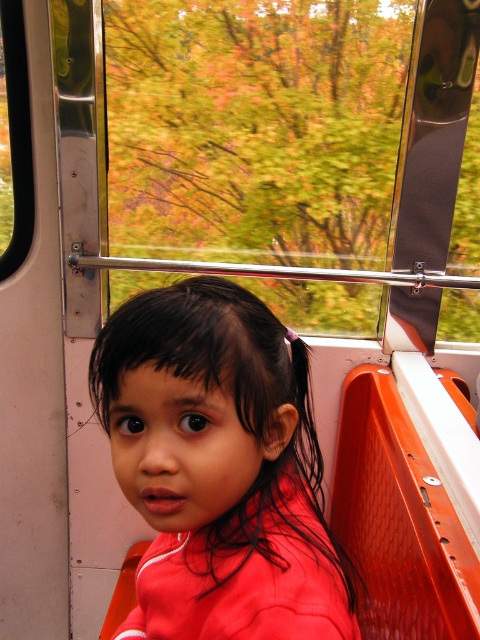
You are a passenger on a train and want to look outside through the transparent glass window at center. Where should you look relative to the point marked at (254, 129)?

The transparent glass window at center is exactly at the point marked (254, 129), so you should look directly at that point to see outside.

You are a parent trying to ensure your child has enough space to move between the transparent glass window at center and the black plastic window at upper left. Can you determine if there is enough space between them for your child to comfortably move around?

The transparent glass window at center and black plastic window at upper left are 27.15 inches apart from each other, so there is sufficient space for the child to move comfortably between them.

You are a photographer taking a picture of the matte red shirt at center and the black plastic window at upper left. Which object is shorter in the image?

The matte red shirt at center has a lesser height compared to the black plastic window at upper left, so the matte red shirt at center is shorter.